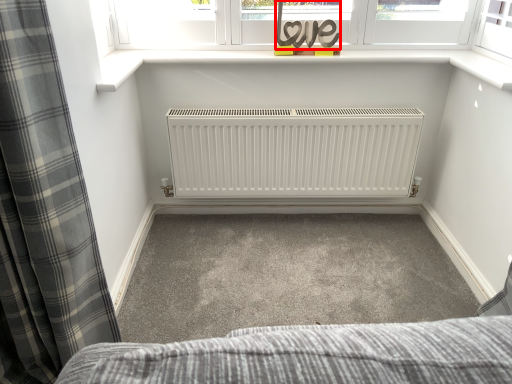
Question: Observing the image, what is the correct spatial positioning of writing (annotated by the red box) in reference to curtain?

Choices:
 (A) left
 (B) right

Answer: (B)